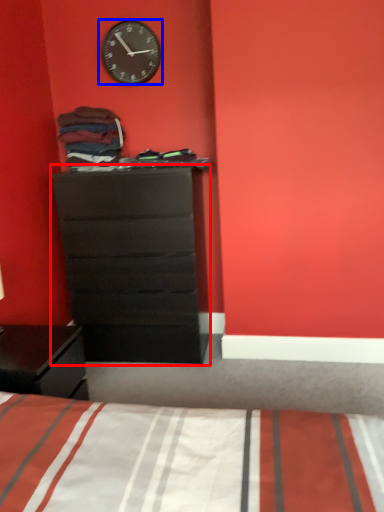
Question: Which point is further to the camera, chest of drawers (highlighted by a red box) or wall clock (highlighted by a blue box)?

Choices:
 (A) chest of drawers
 (B) wall clock

Answer: (B)